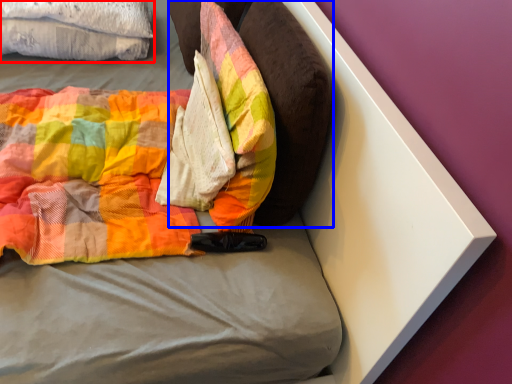
Question: Among these objects, which one is farthest to the camera, cloth (highlighted by a red box) or pillow (highlighted by a blue box)?

Choices:
 (A) cloth
 (B) pillow

Answer: (A)